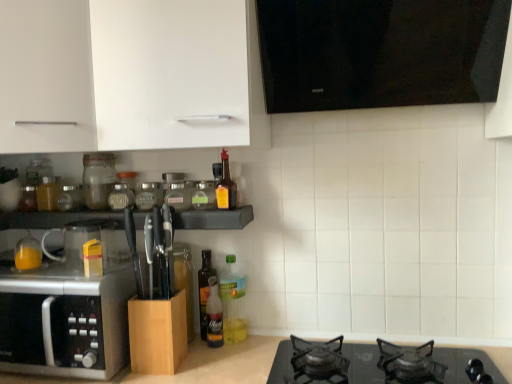
Question: From a real-world perspective, is translucent plastic bottle at center, the 3th bottle in the right-to-left sequence, positioned above or below translucent glass jar at upper left, which appears as the first bottle when viewed from the left?

Choices:
 (A) below
 (B) above

Answer: (A)

Question: In terms of width, does translucent plastic bottle at center, which ranks as the 4th bottle in left-to-right order, look wider or thinner when compared to translucent glass jar at upper left, which appears as the first bottle when viewed from the left?

Choices:
 (A) thin
 (B) wide

Answer: (A)

Question: Considering the real-world distances, which object is farthest from the transparent glass mug at left?

Choices:
 (A) wooden knife block at center, which is the 3th cabinetry from top to bottom
 (B) transparent glass jar at center, the 3th glass jar when ordered from left to right
 (C) translucent plastic bottle at center, which appears as the 6th bottle when viewed from the left
 (D) white matte cabinet at upper left, the first cabinetry viewed from the top
 (E) transparent glass jar at center, arranged as the 2th glass jar when viewed from the right

Answer: (D)

Question: Which object is the farthest from the black glass gas stove at lower center?

Choices:
 (A) wooden knife block at center
 (B) translucent glass bottle at left, marked as the 2th bottle in a left-to-right arrangement
 (C) transparent glass jar at center, which appears as the 1th glass jar when viewed from the left
 (D) transparent glass jar at center, positioned as the second glass jar in left-to-right order
 (E) translucent plastic bottle at upper center, which is counted as the 2th bottle, starting from the right

Answer: (B)